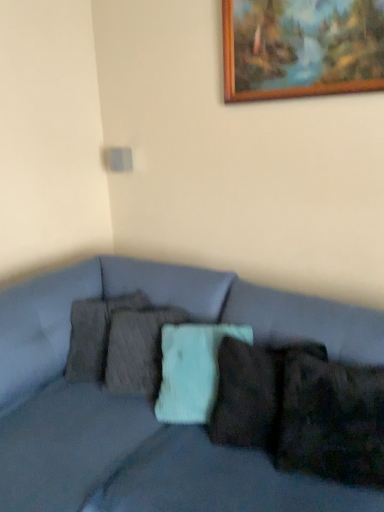
Question: Is wooden picture frame at upper center placed right next to textured gray pillow at center, the 1th pillow in the left-to-right sequence?

Choices:
 (A) yes
 (B) no

Answer: (B)

Question: Is wooden picture frame at upper center facing towards textured gray pillow at center, positioned as the first pillow in back-to-front order?

Choices:
 (A) yes
 (B) no

Answer: (B)

Question: Considering the relative sizes of wooden picture frame at upper center and textured gray pillow at center, the second pillow viewed from the right, in the image provided, is wooden picture frame at upper center bigger than textured gray pillow at center, the second pillow viewed from the right,?

Choices:
 (A) no
 (B) yes

Answer: (A)

Question: From a real-world perspective, does wooden picture frame at upper center stand above textured gray pillow at center, the 2th pillow positioned from the front?

Choices:
 (A) yes
 (B) no

Answer: (A)

Question: Can you confirm if wooden picture frame at upper center is smaller than textured gray pillow at center, positioned as the first pillow in back-to-front order?

Choices:
 (A) yes
 (B) no

Answer: (A)

Question: Can you confirm if wooden picture frame at upper center is positioned to the left of textured gray pillow at center, the 2th pillow positioned from the front?

Choices:
 (A) no
 (B) yes

Answer: (A)

Question: Can you confirm if velvety brown pillow at lower right, the 2th pillow in the left-to-right sequence, is bigger than wooden picture frame at upper center?

Choices:
 (A) no
 (B) yes

Answer: (B)

Question: From the image's perspective, is velvety brown pillow at lower right, marked as the 1th pillow in a front-to-back arrangement, on wooden picture frame at upper center?

Choices:
 (A) yes
 (B) no

Answer: (B)

Question: From the image's perspective, is velvety brown pillow at lower right, positioned as the 1th pillow in right-to-left order, below wooden picture frame at upper center?

Choices:
 (A) no
 (B) yes

Answer: (B)

Question: Is velvety brown pillow at lower right, marked as the 1th pillow in a front-to-back arrangement, facing towards wooden picture frame at upper center?

Choices:
 (A) yes
 (B) no

Answer: (B)

Question: From a real-world perspective, is velvety brown pillow at lower right, the 2th pillow in the left-to-right sequence, beneath wooden picture frame at upper center?

Choices:
 (A) no
 (B) yes

Answer: (B)

Question: Considering the relative positions of velvety brown pillow at lower right, the 2th pillow in the left-to-right sequence, and wooden picture frame at upper center in the image provided, is velvety brown pillow at lower right, the 2th pillow in the left-to-right sequence, to the left of wooden picture frame at upper center from the viewer's perspective?

Choices:
 (A) yes
 (B) no

Answer: (B)

Question: From the image's perspective, does matte gray couch at center appear higher than wooden picture frame at upper center?

Choices:
 (A) yes
 (B) no

Answer: (B)